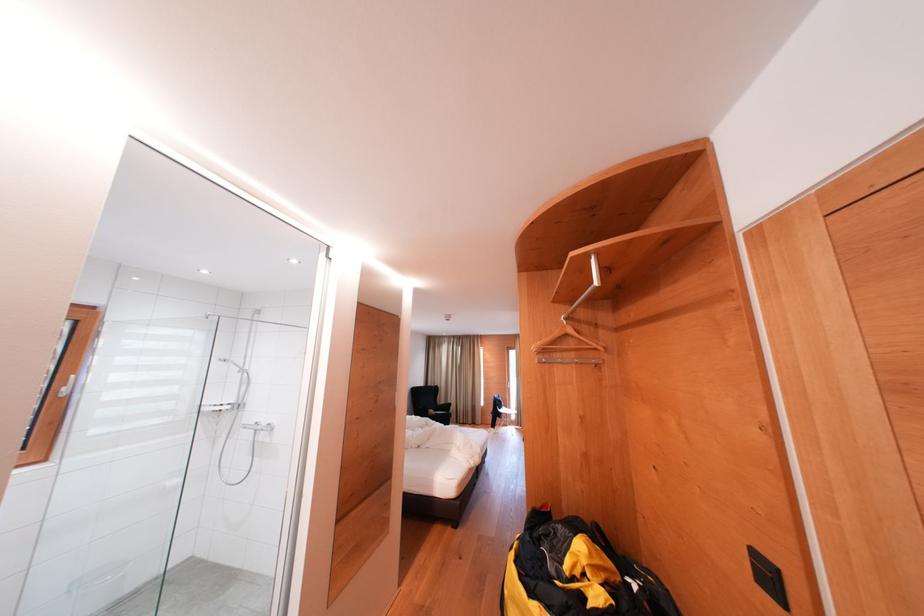
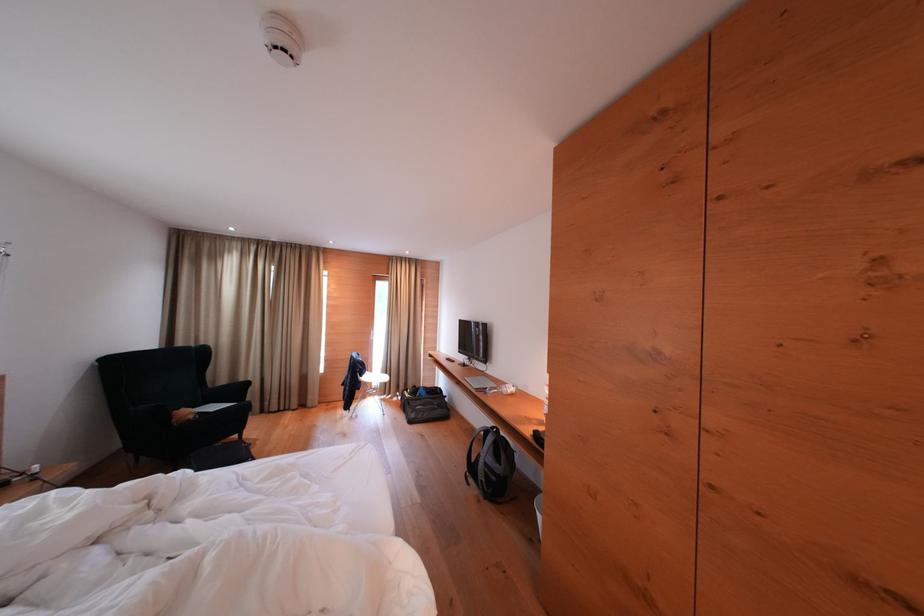
In the second image, find the point that corresponds to [454,411] in the first image.

(244, 394)